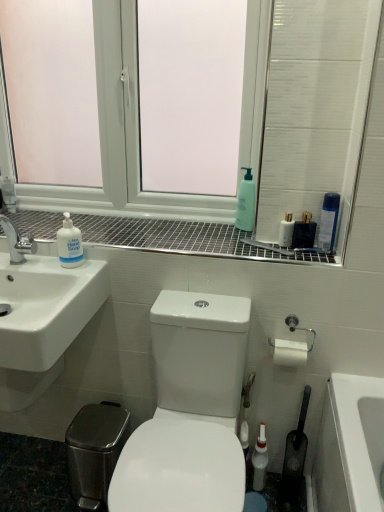
This screenshot has height=512, width=384. What are the coordinates of `space that is in front of black plastic mouthwash at upper right, the third mouthwash viewed from the left` in the screenshot? It's located at (302, 254).